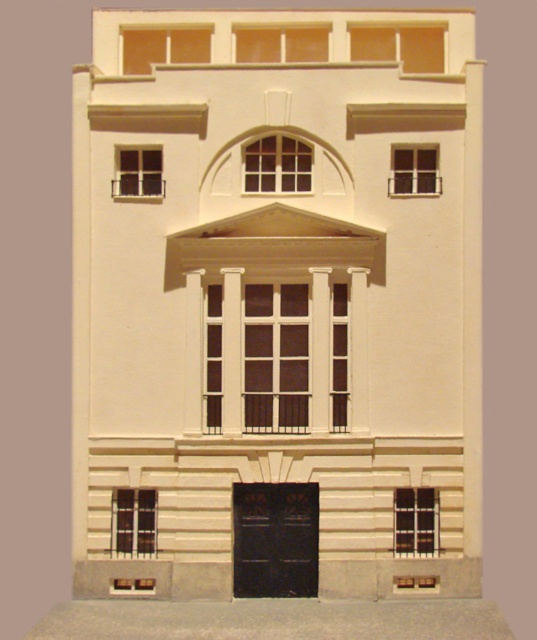
Question: Which of the following is the closest to the observer?

Choices:
 (A) (426, 552)
 (B) (205, 28)
 (C) (147, 184)

Answer: (A)

Question: Which point appears farthest from the camera in this image?

Choices:
 (A) (407, 538)
 (B) (141, 28)
 (C) (430, 148)

Answer: (B)

Question: Is matte glass window at upper center below matte glass window at upper left?

Choices:
 (A) yes
 (B) no

Answer: (B)

Question: In this image, where is matte wood window at center located relative to matte glass window at upper left?

Choices:
 (A) right
 (B) left

Answer: (A)

Question: Which object is closer to the camera taking this photo?

Choices:
 (A) matte wood window at center
 (B) matte glass window at upper right
 (C) matte black window at lower left
 (D) matte black window at lower right

Answer: (D)

Question: Does matte glass window at center appear on the right side of matte glass window at upper right?

Choices:
 (A) yes
 (B) no

Answer: (B)